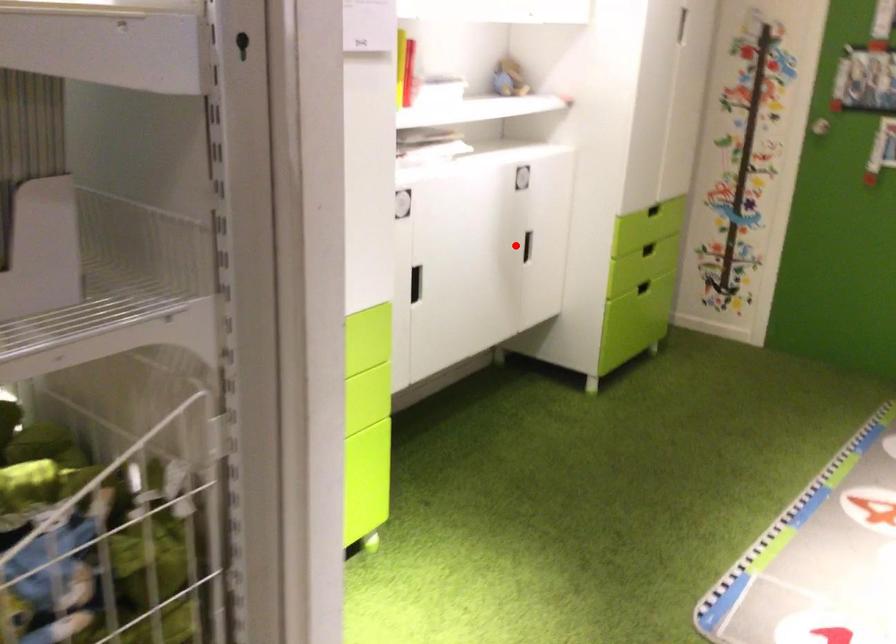
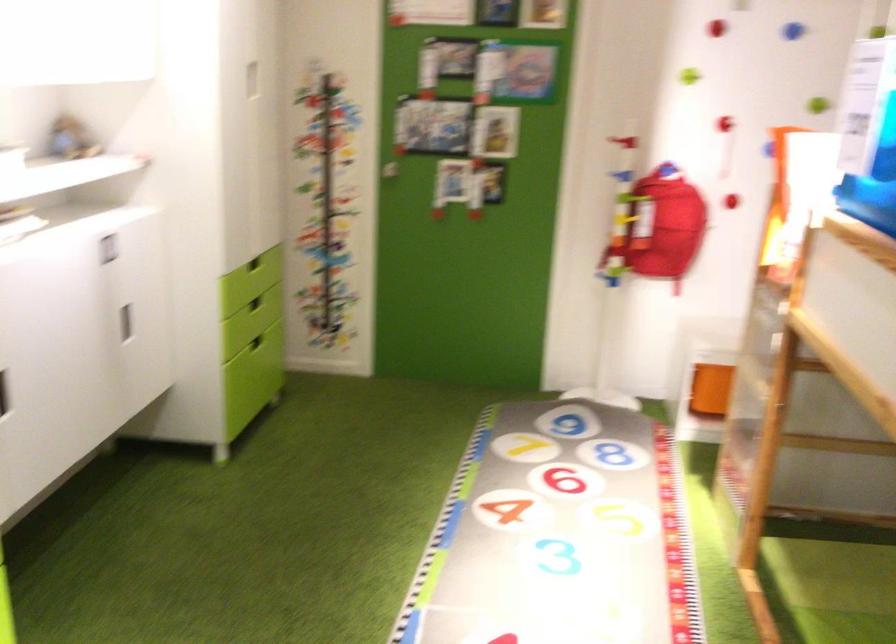
In the second image, find the point that corresponds to the highlighted location in the first image.

(125, 323)